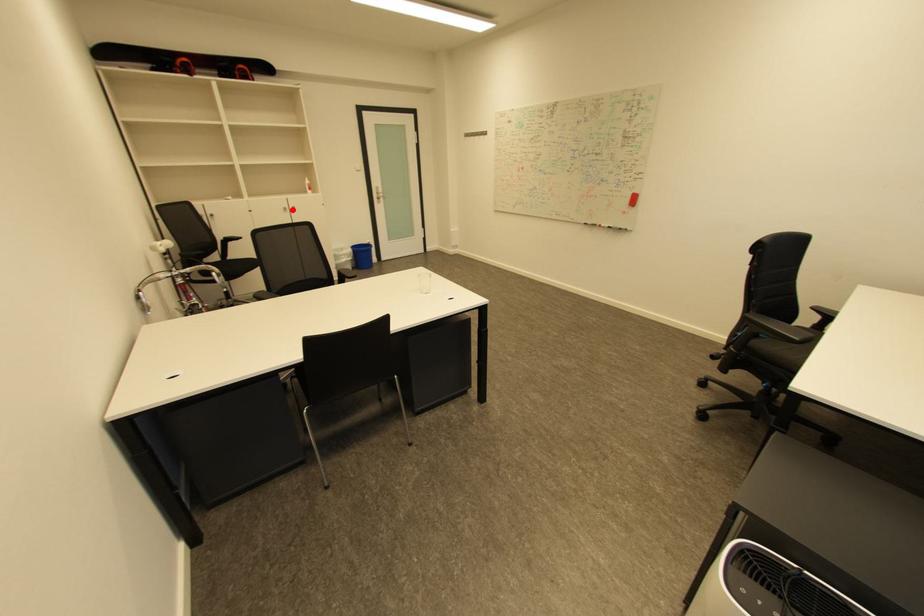
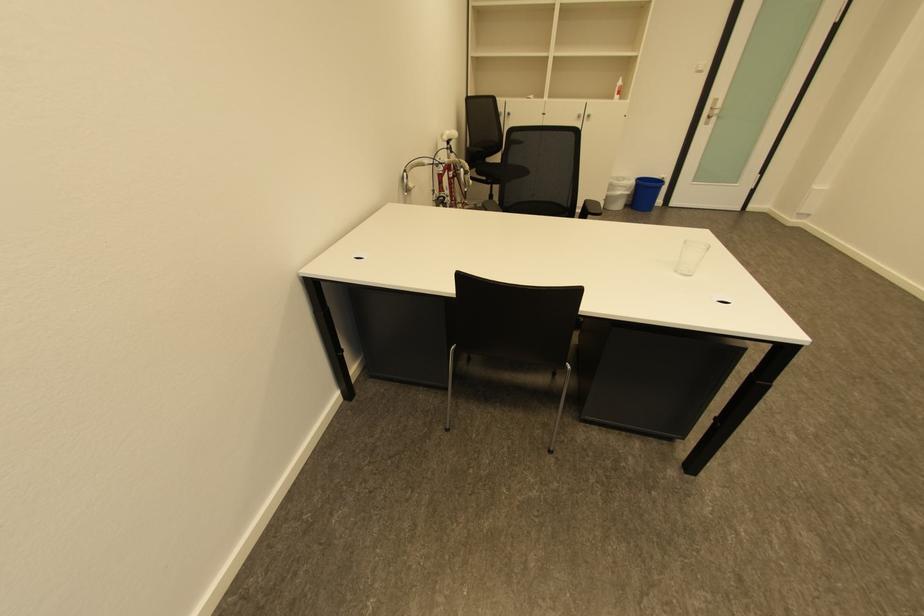
In the second image, find the point that corresponds to the highlighted location in the first image.

(585, 118)